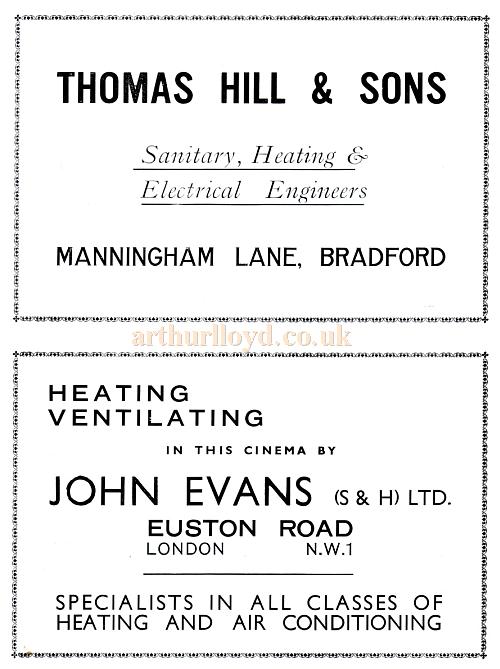
Where is `boxes`? Image resolution: width=500 pixels, height=669 pixels. boxes is located at coordinates (238, 173), (241, 518).